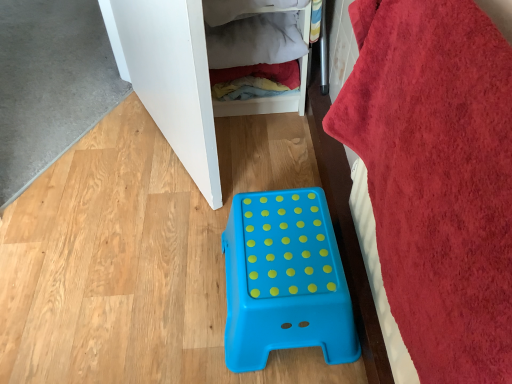
Question: Does blue plastic step stool at center, the 2th furniture from the left, have a greater height compared to wooden/textured clothes at upper center?

Choices:
 (A) no
 (B) yes

Answer: (A)

Question: Is blue plastic step stool at center, the 1th furniture in the right-to-left sequence, at the right side of wooden/textured clothes at upper center?

Choices:
 (A) yes
 (B) no

Answer: (A)

Question: Considering the relative sizes of blue plastic step stool at center, the 1th furniture in the right-to-left sequence, and wooden/textured clothes at upper center in the image provided, is blue plastic step stool at center, the 1th furniture in the right-to-left sequence, wider than wooden/textured clothes at upper center?

Choices:
 (A) no
 (B) yes

Answer: (B)

Question: Is blue plastic step stool at center, the first furniture when ordered from bottom to top, positioned with its back to wooden/textured clothes at upper center?

Choices:
 (A) yes
 (B) no

Answer: (B)

Question: Does blue plastic step stool at center, the second furniture from the top, come in front of wooden/textured clothes at upper center?

Choices:
 (A) no
 (B) yes

Answer: (B)

Question: Based on their sizes in the image, would you say wooden/textured clothes at upper center is bigger or smaller than white matte cabinet at upper left, acting as the second furniture starting from the bottom?

Choices:
 (A) small
 (B) big

Answer: (A)

Question: From the image's perspective, is wooden/textured clothes at upper center above or below white matte cabinet at upper left, placed as the second furniture when sorted from right to left?

Choices:
 (A) above
 (B) below

Answer: (A)

Question: Considering the positions of point (303, 105) and point (173, 57), is point (303, 105) closer or farther from the camera than point (173, 57)?

Choices:
 (A) closer
 (B) farther

Answer: (B)

Question: In the image, is wooden/textured clothes at upper center on the left side or the right side of white matte cabinet at upper left, acting as the first furniture starting from the top?

Choices:
 (A) left
 (B) right

Answer: (B)

Question: In the image, is white matte cabinet at upper left, marked as the first furniture in a left-to-right arrangement, positioned in front of or behind blue plastic step stool at center, the first furniture when ordered from bottom to top?

Choices:
 (A) front
 (B) behind

Answer: (B)

Question: Based on their sizes in the image, would you say white matte cabinet at upper left, acting as the first furniture starting from the top, is bigger or smaller than blue plastic step stool at center, the second furniture from the top?

Choices:
 (A) small
 (B) big

Answer: (B)

Question: Considering the relative positions of white matte cabinet at upper left, acting as the second furniture starting from the bottom, and blue plastic step stool at center, the second furniture from the top, in the image provided, is white matte cabinet at upper left, acting as the second furniture starting from the bottom, to the left or to the right of blue plastic step stool at center, the second furniture from the top,?

Choices:
 (A) right
 (B) left

Answer: (B)

Question: Is white matte cabinet at upper left, acting as the first furniture starting from the top, wider or thinner than blue plastic step stool at center, the 1th furniture in the right-to-left sequence?

Choices:
 (A) wide
 (B) thin

Answer: (B)

Question: From a real-world perspective, is white matte cabinet at upper left, acting as the first furniture starting from the top, above or below wooden/textured clothes at upper center?

Choices:
 (A) below
 (B) above

Answer: (B)

Question: In the image, is white matte cabinet at upper left, marked as the first furniture in a left-to-right arrangement, on the left side or the right side of wooden/textured clothes at upper center?

Choices:
 (A) left
 (B) right

Answer: (A)